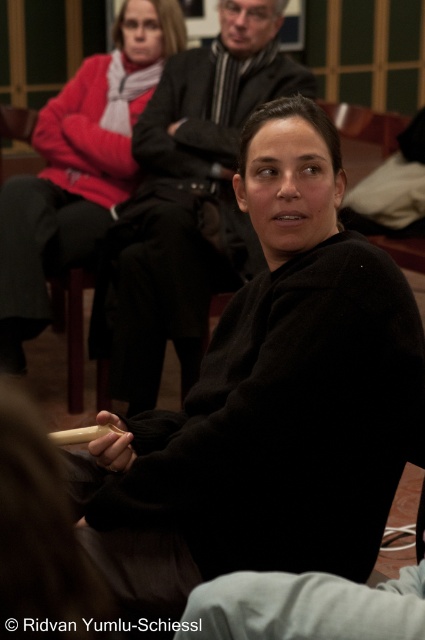
You are standing in the lecture hall and notice two points marked in the image. Which point, point (x=421, y=390) or point (x=28, y=300), is nearer to you?

Point (x=421, y=390) is closer to the viewer than point (x=28, y=300).

You are a delivery robot that is 1.5 meters tall. You need to deliver a package to the black matte sweater at center. However, there is a matte black sweater at upper left in the way. Can you pass through the space between them?

The distance between the black matte sweater at center and the matte black sweater at upper left is 1.74 meters. Since the robot is 1.5 meters tall, it can pass through the space between them as the distance is greater than the robot height.

Consider the image. Based on the scene description, which object is positioned lower in the image? The black matte sweater at center or the matte black sweater at upper left?

The black matte sweater at center is located below matte black sweater at upper left, so the black matte sweater at center is positioned lower in the image.